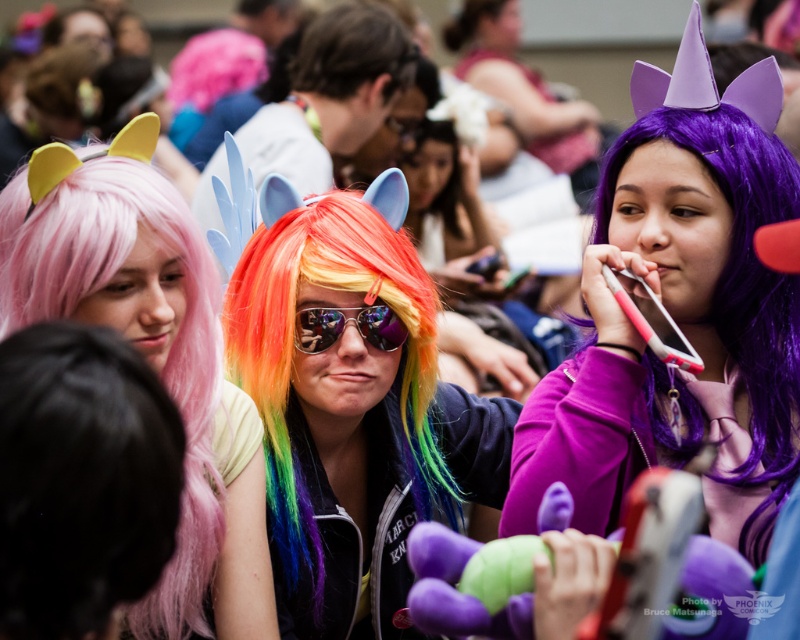
Who is more distant from viewer, (264, 625) or (377, 342)?

The point (377, 342) is more distant.

Is point (178, 392) closer to viewer compared to point (368, 324)?

Yes, it is in front of point (368, 324).

This screenshot has width=800, height=640. What are the coordinates of `pink wig at upper left` in the screenshot? It's located at (152, 362).

Based on the photo, does rainbow wig at center come in front of purple matte wig at upper right?

Yes.

Which is in front, point (432, 474) or point (468, 36)?

Point (432, 474) is more forward.

The width and height of the screenshot is (800, 640). Find the location of `rainbow wig at center`. rainbow wig at center is located at coordinates (352, 417).

The width and height of the screenshot is (800, 640). In order to click on brown matte hair at center in this screenshot , I will do `click(352, 52)`.

Who is more distant from viewer, [364,4] or [310,323]?

Point [364,4]

Is point (394, 77) positioned after point (390, 337)?

That is True.

At what (x,y) coordinates should I click in order to perform the action: click on brown matte hair at center. Please return your answer as a coordinate pair (x, y). The width and height of the screenshot is (800, 640). Looking at the image, I should click on (352, 52).